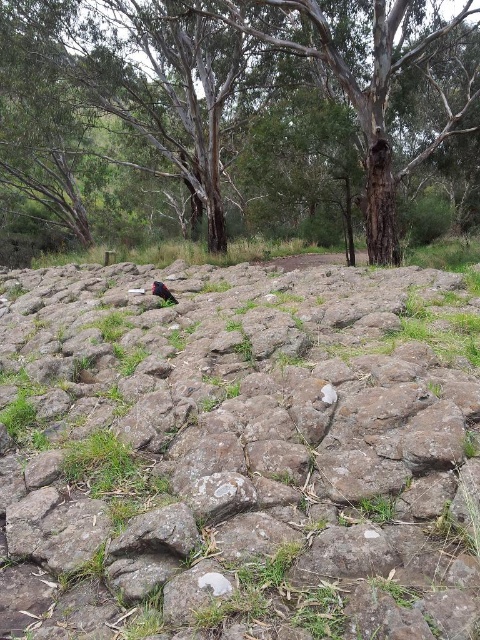
Question: Is rough textured rock at center below brown textured tree at upper center?

Choices:
 (A) yes
 (B) no

Answer: (A)

Question: Among these points, which one is farthest from the camera?

Choices:
 (A) (409, 620)
 (B) (170, 292)

Answer: (B)

Question: Does rough textured rock at center appear on the right side of brown textured tree at upper center?

Choices:
 (A) no
 (B) yes

Answer: (B)

Question: Estimate the real-world distances between objects in this image. Which object is farther from the rough textured rock at center?

Choices:
 (A) brown textured tree at upper center
 (B) shiny black bird at center

Answer: (A)

Question: Can you confirm if brown textured tree at upper center is positioned to the left of shiny black bird at center?

Choices:
 (A) yes
 (B) no

Answer: (A)

Question: Which object is positioned closest to the shiny black bird at center?

Choices:
 (A) brown textured tree at upper center
 (B) rough textured rock at center

Answer: (B)